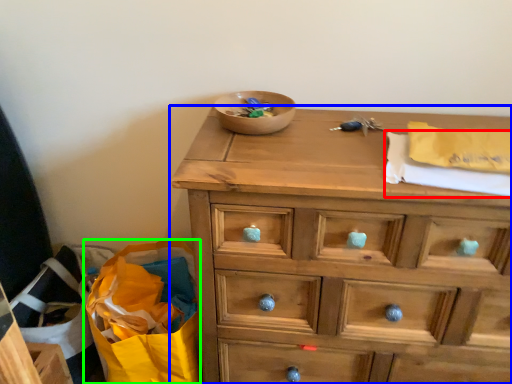
Question: Which is farther away from clothe (highlighted by a red box)? chest of drawers (highlighted by a blue box) or shopping bag (highlighted by a green box)?

Choices:
 (A) chest of drawers
 (B) shopping bag

Answer: (B)